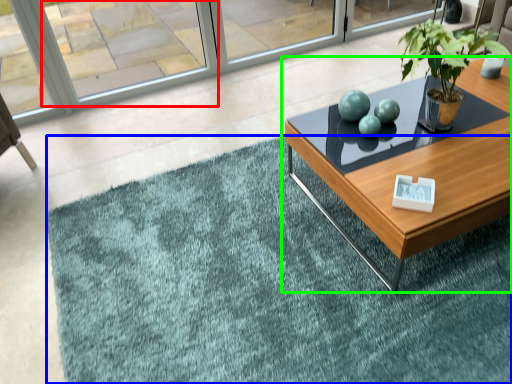
Question: Which object is the closest to the window (highlighted by a red box)? Choose among these: doormat (highlighted by a blue box) or coffee table (highlighted by a green box).

Choices:
 (A) doormat
 (B) coffee table

Answer: (B)